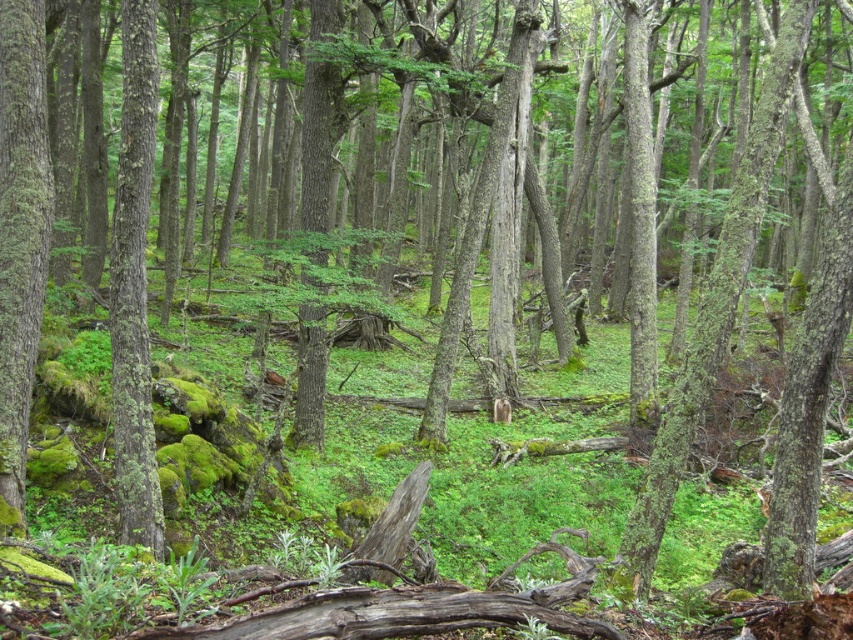
You are a botanist studying the forest floor. You notice the green mossy bark at left. Where exactly is this mossy bark located in the image?

The green mossy bark at left is located at point coordinates of 0.359 on the x axis and 0.026 on the y axis.

You are a hiker trying to navigate through the dense forest. You see two green mossy barks in the left side of your view. One is labeled as green mossy bark at left and the other is green mossy bark tree trunk at left. If you want to step between them, do you think you can fit through the space between them?

The distance between the green mossy bark at left and the green mossy bark tree trunk at left is 29.31 inches. Since the average person requires about 30 inches of space to pass through comfortably, the space is slightly narrower than needed. You might have to move sideways or choose a different path for easier navigation.

You are a hiker who just entered the forest and see the green mossy bark at left and the green mossy bark tree trunk at left. Which one is higher up from the ground?

The green mossy bark at left is higher up from the ground than the green mossy bark tree trunk at left.